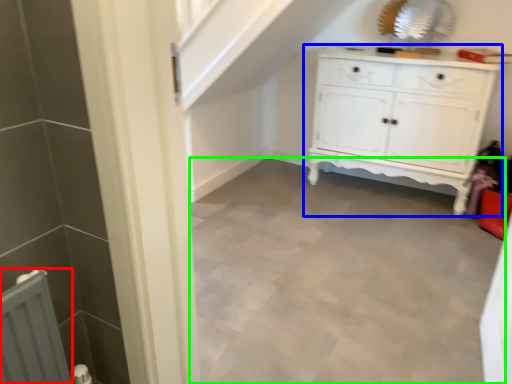
Question: Based on their relative distances, which object is nearer to radiator (highlighted by a red box)? Choose from chest of drawers (highlighted by a blue box) and plain (highlighted by a green box).

Choices:
 (A) chest of drawers
 (B) plain

Answer: (B)